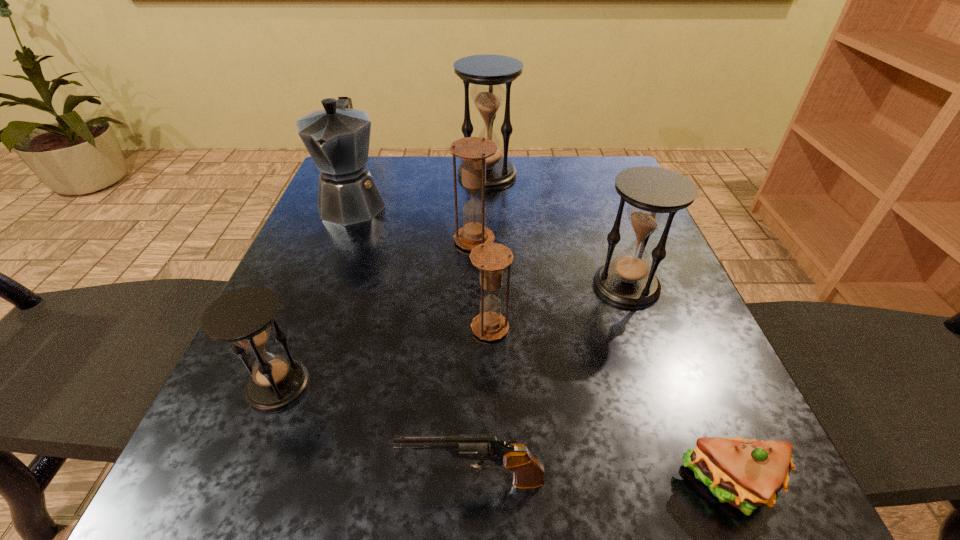
Where is `hourglass identified as the closest to the farthest black hourglass`? This screenshot has width=960, height=540. hourglass identified as the closest to the farthest black hourglass is located at coordinates (473, 151).

Locate which hourglass ranks second in proximity to the farthest hourglass. Please provide its 2D coordinates. Your answer should be formatted as a tuple, i.e. [(x, y)], where the tuple contains the x and y coordinates of a point satisfying the conditions above.

[(654, 195)]

Select which black hourglass is the closest to the black gun. Please provide its 2D coordinates. Your answer should be formatted as a tuple, i.e. [(x, y)], where the tuple contains the x and y coordinates of a point satisfying the conditions above.

[(243, 316)]

Identify which black hourglass is the second nearest to the sandwich. Please provide its 2D coordinates. Your answer should be formatted as a tuple, i.e. [(x, y)], where the tuple contains the x and y coordinates of a point satisfying the conditions above.

[(243, 316)]

Find the location of `free space that satisfies the following two spatial constraints: 1. along the barrel of the fourth farthest hourglass; 2. on the left side of the black gun`. free space that satisfies the following two spatial constraints: 1. along the barrel of the fourth farthest hourglass; 2. on the left side of the black gun is located at coordinates (475, 328).

This screenshot has width=960, height=540. Find the location of `vacant region that satisfies the following two spatial constraints: 1. on the front side of the sandwich; 2. on the left side of the second nearest hourglass`. vacant region that satisfies the following two spatial constraints: 1. on the front side of the sandwich; 2. on the left side of the second nearest hourglass is located at coordinates (493, 486).

Where is `vacant space that satisfies the following two spatial constraints: 1. on the back side of the sixth farthest object; 2. on the right side of the fifth farthest object`? This screenshot has width=960, height=540. vacant space that satisfies the following two spatial constraints: 1. on the back side of the sixth farthest object; 2. on the right side of the fifth farthest object is located at coordinates (301, 328).

This screenshot has width=960, height=540. What are the coordinates of `free space in the image that satisfies the following two spatial constraints: 1. at the spout of the coffeepot; 2. along the barrel of the black gun` in the screenshot? It's located at (244, 481).

Where is `free space that satisfies the following two spatial constraints: 1. at the spout of the bigger brown hourglass; 2. on the right side of the coffeepot`? The width and height of the screenshot is (960, 540). free space that satisfies the following two spatial constraints: 1. at the spout of the bigger brown hourglass; 2. on the right side of the coffeepot is located at coordinates [338, 240].

Identify the location of free location that satisfies the following two spatial constraints: 1. on the front side of the rightmost black hourglass; 2. on the right side of the bigger brown hourglass. (473, 286).